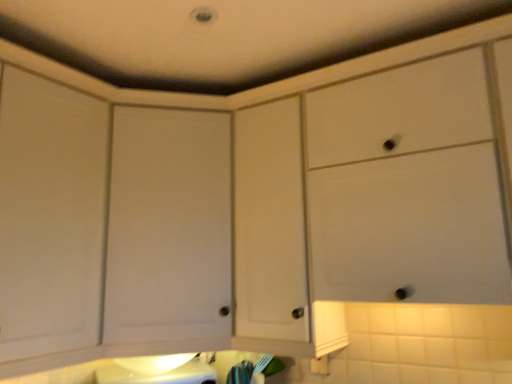
The width and height of the screenshot is (512, 384). Describe the element at coordinates (168, 229) in the screenshot. I see `white matte cabinet door at center, which is the 1th cabinetry from left to right` at that location.

Identify the location of white matte cabinet door at center, the 2th cabinetry viewed from the right. The width and height of the screenshot is (512, 384). (168, 229).

Measure the distance between white matte cabinet at upper center, which is counted as the first cabinetry, starting from the right, and camera.

A distance of 1.15 meters exists between white matte cabinet at upper center, which is counted as the first cabinetry, starting from the right, and camera.

Locate an element on the screen. Image resolution: width=512 pixels, height=384 pixels. white matte cabinet at upper center, the second cabinetry from the left is located at coordinates (407, 186).

This screenshot has width=512, height=384. What do you see at coordinates (407, 186) in the screenshot?
I see `white matte cabinet at upper center, which is counted as the first cabinetry, starting from the right` at bounding box center [407, 186].

In order to face white matte cabinet at upper center, which is counted as the first cabinetry, starting from the right, should I rotate leftwards or rightwards?

Turn right by 15.027 degrees to look at white matte cabinet at upper center, which is counted as the first cabinetry, starting from the right.

This screenshot has width=512, height=384. Identify the location of white matte cabinet door at center, the 2th cabinetry viewed from the right. (168, 229).

Considering the positions of objects white matte cabinet door at center, the 2th cabinetry viewed from the right, and white matte cabinet at upper center, the second cabinetry from the left, in the image provided, who is more to the left, white matte cabinet door at center, the 2th cabinetry viewed from the right, or white matte cabinet at upper center, the second cabinetry from the left,?

From the viewer's perspective, white matte cabinet door at center, the 2th cabinetry viewed from the right, appears more on the left side.

Considering the positions of objects white matte cabinet door at center, which is the 1th cabinetry from left to right, and white matte cabinet at upper center, which is counted as the first cabinetry, starting from the right, in the image provided, who is in front, white matte cabinet door at center, which is the 1th cabinetry from left to right, or white matte cabinet at upper center, which is counted as the first cabinetry, starting from the right,?

white matte cabinet at upper center, which is counted as the first cabinetry, starting from the right, is closer to the camera.

Is point (116, 224) positioned in front of point (337, 109)?

No, (116, 224) is behind (337, 109).

From the image's perspective, which one is positioned higher, white matte cabinet door at center, which is the 1th cabinetry from left to right, or white matte cabinet at upper center, which is counted as the first cabinetry, starting from the right?

white matte cabinet at upper center, which is counted as the first cabinetry, starting from the right.

From a real-world perspective, which is physically below, white matte cabinet door at center, which is the 1th cabinetry from left to right, or white matte cabinet at upper center, which is counted as the first cabinetry, starting from the right?

white matte cabinet at upper center, which is counted as the first cabinetry, starting from the right, from a real-world perspective.

Considering the sizes of objects white matte cabinet door at center, the 2th cabinetry viewed from the right, and white matte cabinet at upper center, the second cabinetry from the left, in the image provided, who is thinner, white matte cabinet door at center, the 2th cabinetry viewed from the right, or white matte cabinet at upper center, the second cabinetry from the left,?

With smaller width is white matte cabinet at upper center, the second cabinetry from the left.

Who is shorter, white matte cabinet door at center, which is the 1th cabinetry from left to right, or white matte cabinet at upper center, the second cabinetry from the left?

With less height is white matte cabinet at upper center, the second cabinetry from the left.

In terms of size, does white matte cabinet door at center, which is the 1th cabinetry from left to right, appear bigger or smaller than white matte cabinet at upper center, which is counted as the first cabinetry, starting from the right?

white matte cabinet door at center, which is the 1th cabinetry from left to right, is smaller than white matte cabinet at upper center, which is counted as the first cabinetry, starting from the right.

Is white matte cabinet at upper center, the second cabinetry from the left, a part of white matte cabinet door at center, which is the 1th cabinetry from left to right?

No, white matte cabinet door at center, which is the 1th cabinetry from left to right, does not contain white matte cabinet at upper center, the second cabinetry from the left.

Are white matte cabinet door at center, which is the 1th cabinetry from left to right, and white matte cabinet at upper center, the second cabinetry from the left, located far from each other?

white matte cabinet door at center, which is the 1th cabinetry from left to right, is near white matte cabinet at upper center, the second cabinetry from the left, not far away.

Is white matte cabinet at upper center, the second cabinetry from the left, at the back of white matte cabinet door at center, the 2th cabinetry viewed from the right?

white matte cabinet door at center, the 2th cabinetry viewed from the right, is not turned away from white matte cabinet at upper center, the second cabinetry from the left.

Measure the distance between white matte cabinet door at center, the 2th cabinetry viewed from the right, and white matte cabinet at upper center, the second cabinetry from the left.

white matte cabinet door at center, the 2th cabinetry viewed from the right, and white matte cabinet at upper center, the second cabinetry from the left, are 24.03 inches apart.

Where is `cabinetry located on the right of white matte cabinet door at center, which is the 1th cabinetry from left to right`? Image resolution: width=512 pixels, height=384 pixels. cabinetry located on the right of white matte cabinet door at center, which is the 1th cabinetry from left to right is located at coordinates (407, 186).

From the picture: Which object is positioned more to the left, white matte cabinet at upper center, which is counted as the first cabinetry, starting from the right, or white matte cabinet door at center, which is the 1th cabinetry from left to right?

From the viewer's perspective, white matte cabinet door at center, which is the 1th cabinetry from left to right, appears more on the left side.

Considering the positions of objects white matte cabinet at upper center, which is counted as the first cabinetry, starting from the right, and white matte cabinet door at center, the 2th cabinetry viewed from the right, in the image provided, who is behind, white matte cabinet at upper center, which is counted as the first cabinetry, starting from the right, or white matte cabinet door at center, the 2th cabinetry viewed from the right,?

white matte cabinet door at center, the 2th cabinetry viewed from the right.

Is point (362, 124) closer to camera compared to point (227, 157)?

That is True.

From the image's perspective, is white matte cabinet at upper center, which is counted as the first cabinetry, starting from the right, positioned above or below white matte cabinet door at center, which is the 1th cabinetry from left to right?

white matte cabinet at upper center, which is counted as the first cabinetry, starting from the right, is above white matte cabinet door at center, which is the 1th cabinetry from left to right.

From a real-world perspective, between white matte cabinet at upper center, the second cabinetry from the left, and white matte cabinet door at center, which is the 1th cabinetry from left to right, who is vertically lower?

white matte cabinet at upper center, the second cabinetry from the left, is physically lower.

Does white matte cabinet at upper center, which is counted as the first cabinetry, starting from the right, have a greater width compared to white matte cabinet door at center, the 2th cabinetry viewed from the right?

Incorrect, the width of white matte cabinet at upper center, which is counted as the first cabinetry, starting from the right, does not surpass that of white matte cabinet door at center, the 2th cabinetry viewed from the right.

Who is taller, white matte cabinet at upper center, which is counted as the first cabinetry, starting from the right, or white matte cabinet door at center, which is the 1th cabinetry from left to right?

white matte cabinet door at center, which is the 1th cabinetry from left to right.

Can you confirm if white matte cabinet at upper center, the second cabinetry from the left, is bigger than white matte cabinet door at center, which is the 1th cabinetry from left to right?

Yes.

Is white matte cabinet at upper center, the second cabinetry from the left, spatially inside white matte cabinet door at center, which is the 1th cabinetry from left to right, or outside of it?

white matte cabinet at upper center, the second cabinetry from the left, exists outside the volume of white matte cabinet door at center, which is the 1th cabinetry from left to right.

Is white matte cabinet at upper center, the second cabinetry from the left, not near white matte cabinet door at center, which is the 1th cabinetry from left to right?

No, white matte cabinet at upper center, the second cabinetry from the left, is not far from white matte cabinet door at center, which is the 1th cabinetry from left to right.

Is white matte cabinet at upper center, the second cabinetry from the left, turned away from white matte cabinet door at center, which is the 1th cabinetry from left to right?

white matte cabinet at upper center, the second cabinetry from the left, is not turned away from white matte cabinet door at center, which is the 1th cabinetry from left to right.

The width and height of the screenshot is (512, 384). Find the location of `cabinetry below the white matte cabinet door at center, the 2th cabinetry viewed from the right (from a real-world perspective)`. cabinetry below the white matte cabinet door at center, the 2th cabinetry viewed from the right (from a real-world perspective) is located at coordinates (407, 186).

Find the location of `cabinetry that appears behind the white matte cabinet at upper center, which is counted as the first cabinetry, starting from the right`. cabinetry that appears behind the white matte cabinet at upper center, which is counted as the first cabinetry, starting from the right is located at coordinates (168, 229).

Where is `cabinetry above the white matte cabinet at upper center, the second cabinetry from the left (from a real-world perspective)`? This screenshot has height=384, width=512. cabinetry above the white matte cabinet at upper center, the second cabinetry from the left (from a real-world perspective) is located at coordinates (168, 229).